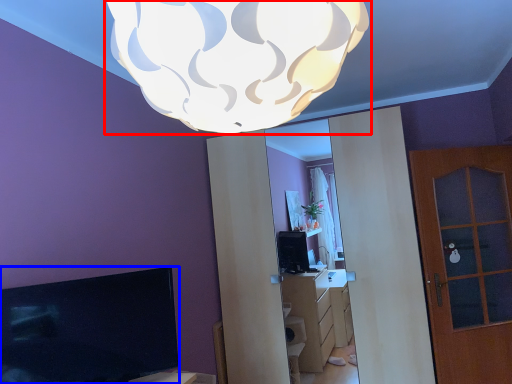
Question: Which of the following is the closest to the observer, lamp (highlighted by a red box) or television (highlighted by a blue box)?

Choices:
 (A) lamp
 (B) television

Answer: (A)